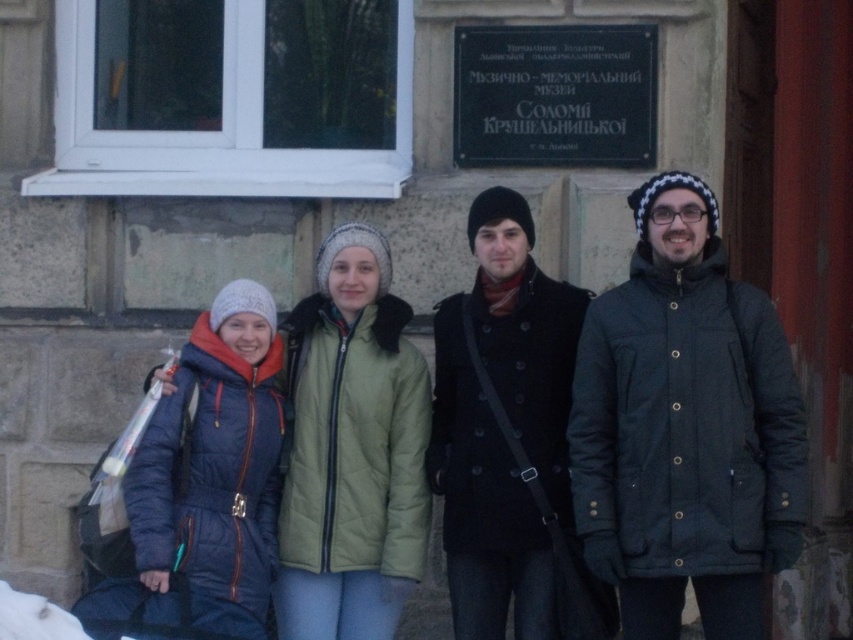
You are a photographer trying to capture a photo of the dark wool coat at center and the green quilted jacket at center. Since both are in the same area, which one is more likely to be visible in your photo?

The dark wool coat at center is positioned over the green quilted jacket at center, so the dark wool coat at center will be more visible in the photo.

You are standing in front of the building with a stone facade and want to hand a gift to the person wearing the dark wool coat at center. Based on their position, can you determine if you should approach from the left or the right side of the group?

The dark wool coat at center is located at point (503,428), so you should approach from the right side of the group to reach the person wearing the dark wool coat at center.